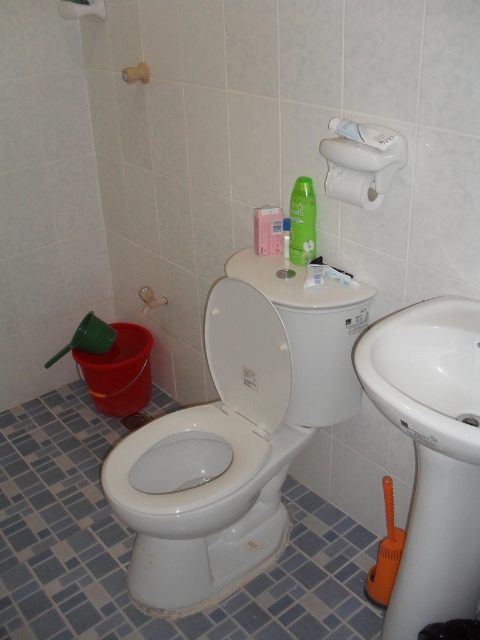
Question: Which point is closer to the camera?

Choices:
 (A) white glossy toilet lid at center
 (B) white glossy sink at lower right
 (C) white ceramic sink at lower right
 (D) white glossy toilet at center

Answer: (C)

Question: Is white glossy sink at lower right wider than white ceramic sink at lower right?

Choices:
 (A) no
 (B) yes

Answer: (B)

Question: Which object appears farthest from the camera in this image?

Choices:
 (A) white matte toilet paper at upper right
 (B) white ceramic sink at lower right
 (C) white glossy toilet lid at center

Answer: (C)

Question: Can you confirm if white glossy toilet at center is wider than green matte lotion at upper center?

Choices:
 (A) yes
 (B) no

Answer: (A)

Question: Which of these objects is positioned farthest from the white glossy sink at lower right?

Choices:
 (A) white glossy toilet lid at center
 (B) green matte lotion at upper center
 (C) white ceramic sink at lower right
 (D) white matte toilet paper at upper right

Answer: (B)

Question: Is white glossy sink at lower right wider than white ceramic sink at lower right?

Choices:
 (A) no
 (B) yes

Answer: (B)